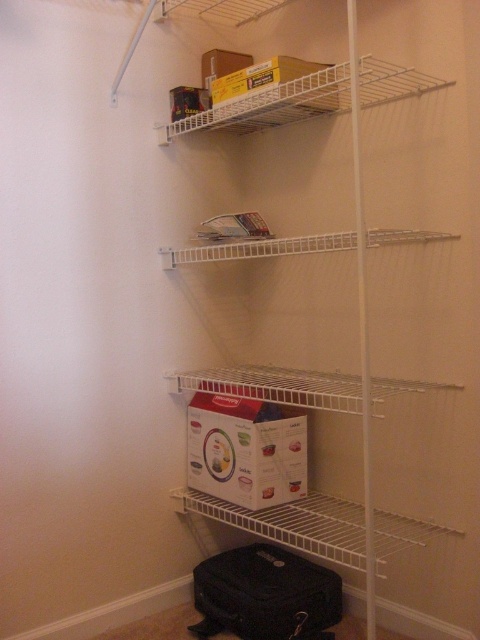
Between white wire shelf at lower center and white wire shelf at upper center, which one is positioned higher?

white wire shelf at upper center

Can you confirm if white wire shelf at lower center is shorter than white wire shelf at upper center?

Incorrect, white wire shelf at lower center's height does not fall short of white wire shelf at upper center's.

What do you see at coordinates (286, 524) in the screenshot? The image size is (480, 640). I see `white wire shelf at lower center` at bounding box center [286, 524].

Locate an element on the screen. This screenshot has height=640, width=480. white wire shelf at lower center is located at coordinates (286, 524).